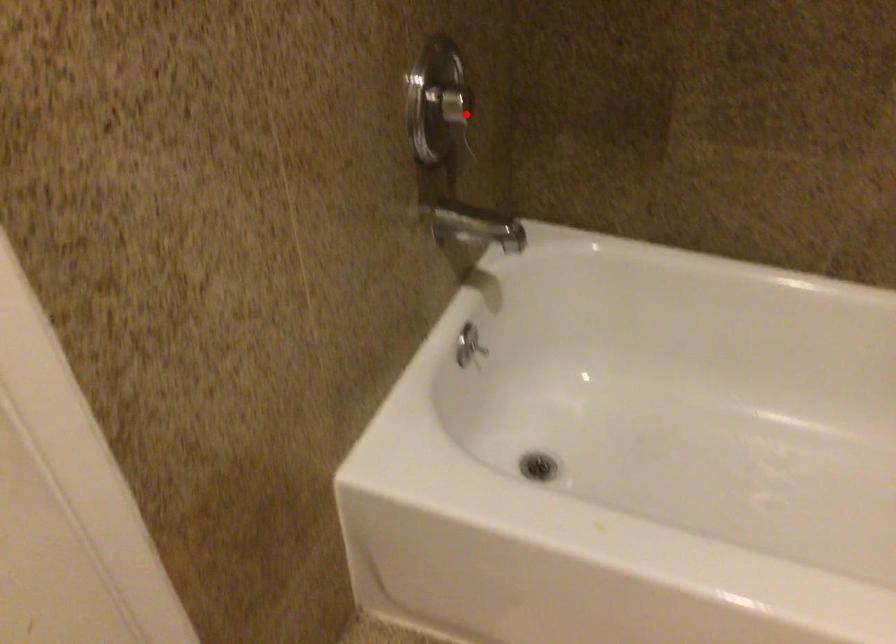
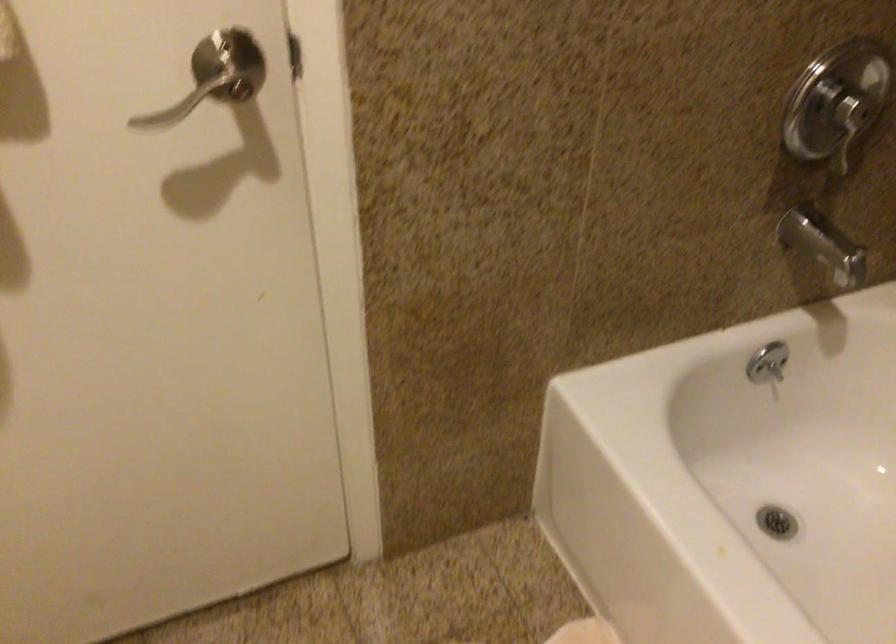
The point at the highlighted location is marked in the first image. Where is the corresponding point in the second image?

(849, 127)